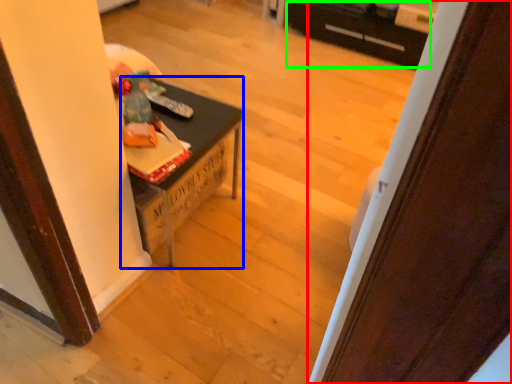
Question: Based on their relative distances, which object is farther from door (highlighted by a red box)? Choose from table (highlighted by a blue box) and drawer (highlighted by a green box).

Choices:
 (A) table
 (B) drawer

Answer: (B)